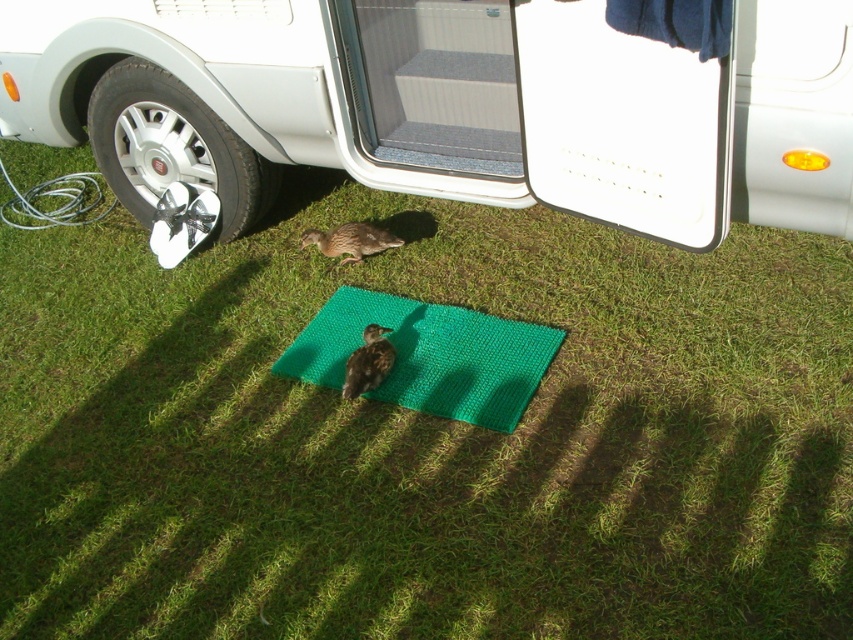
From the picture: You are a delivery person who needs to place a package on the ground near the white matte recreational vehicle at lower left and the brown fuzzy bird at center. Considering their sizes, which object requires more space to accommodate the package?

The white matte recreational vehicle at lower left requires more space to accommodate the package since its width is larger than the brown fuzzy bird at center.

You are standing at the center of the image and want to walk towards the white matte recreational vehicle at lower left. In which direction should you move?

Since the white matte recreational vehicle at lower left is located at point 0.166 on the x and y axis, you should move towards the lower left direction to reach it.